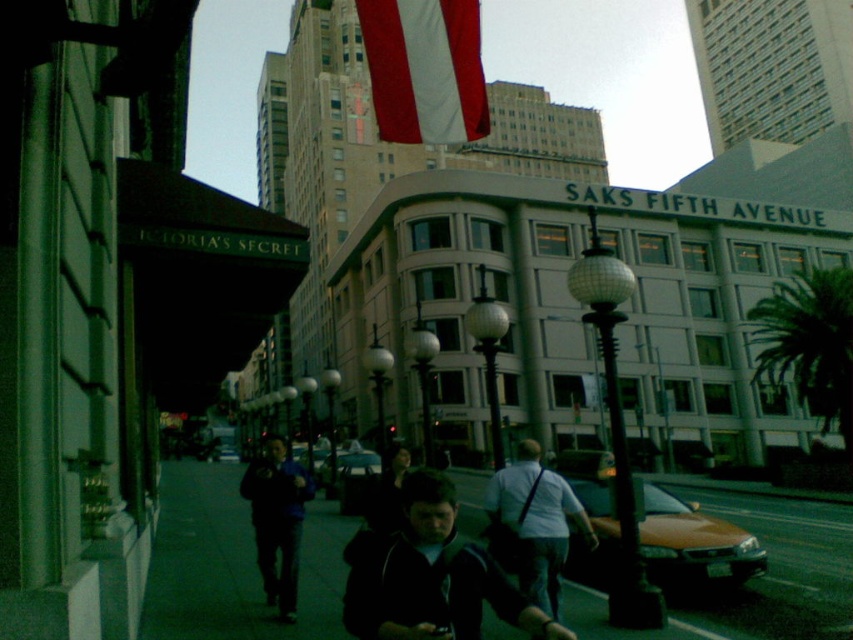
The width and height of the screenshot is (853, 640). Describe the element at coordinates (233, 563) in the screenshot. I see `dark gray asphalt at lower center` at that location.

Can you confirm if dark gray asphalt at lower center is positioned above light blue jeans at center?

Incorrect, dark gray asphalt at lower center is not positioned above light blue jeans at center.

Describe the element at coordinates (233, 563) in the screenshot. The width and height of the screenshot is (853, 640). I see `dark gray asphalt at lower center` at that location.

This screenshot has height=640, width=853. I want to click on dark gray asphalt at lower center, so click(x=233, y=563).

Can you confirm if dark gray asphalt at lower center is wider than dark blue jacket at center?

Yes, dark gray asphalt at lower center is wider than dark blue jacket at center.

Who is more distant from viewer, (598, 589) or (383, 600)?

The point (598, 589) is more distant.

Does point (601, 634) come farther from viewer compared to point (378, 548)?

Yes, it is.

Find the location of a particular element. dark gray asphalt at lower center is located at coordinates click(233, 563).

Between point (450, 502) and point (498, 496), which one is positioned behind?

Positioned behind is point (498, 496).

Who is positioned more to the right, dark blue jacket at center or light blue jeans at center?

From the viewer's perspective, light blue jeans at center appears more on the right side.

The height and width of the screenshot is (640, 853). What are the coordinates of `dark blue jacket at center` in the screenshot? It's located at (431, 576).

Image resolution: width=853 pixels, height=640 pixels. What are the coordinates of `dark blue jacket at center` in the screenshot? It's located at pyautogui.click(x=431, y=576).